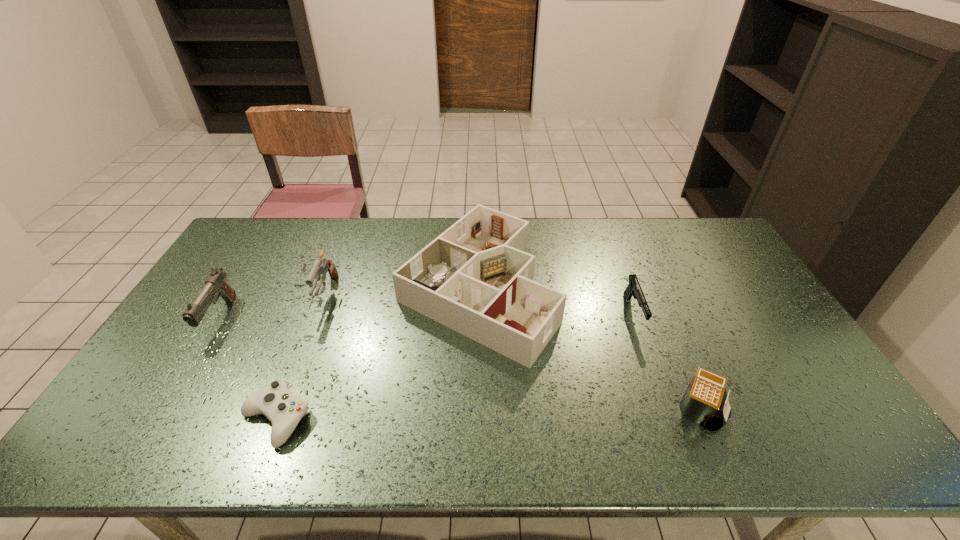
Where is `vacant space at the far left corner`? vacant space at the far left corner is located at coordinates (252, 225).

Image resolution: width=960 pixels, height=540 pixels. In order to click on free space at the near right corner in this screenshot , I will do `click(847, 454)`.

The width and height of the screenshot is (960, 540). Identify the location of free space that is in between the rightmost object and the control. (488, 414).

At what (x,y) coordinates should I click in order to perform the action: click on free spot between the second gun from left to right and the shortest object. Please return your answer as a coordinate pair (x, y). The width and height of the screenshot is (960, 540). Looking at the image, I should click on (300, 356).

What are the coordinates of `unoccupied area between the leftmost gun and the dollhouse` in the screenshot? It's located at (348, 303).

Find the location of a particular element. vacant area that lies between the shortest object and the rightmost object is located at coordinates (488, 414).

This screenshot has height=540, width=960. Identify the location of free space between the leftmost gun and the rightmost object. (460, 364).

Find the location of a particular element. free space between the second gun from left to right and the leftmost gun is located at coordinates (272, 306).

I want to click on the second closest object relative to the fifth object from left to right, so click(475, 278).

Find the location of a particular element. The height and width of the screenshot is (540, 960). the second closest object relative to the shortest object is located at coordinates (216, 285).